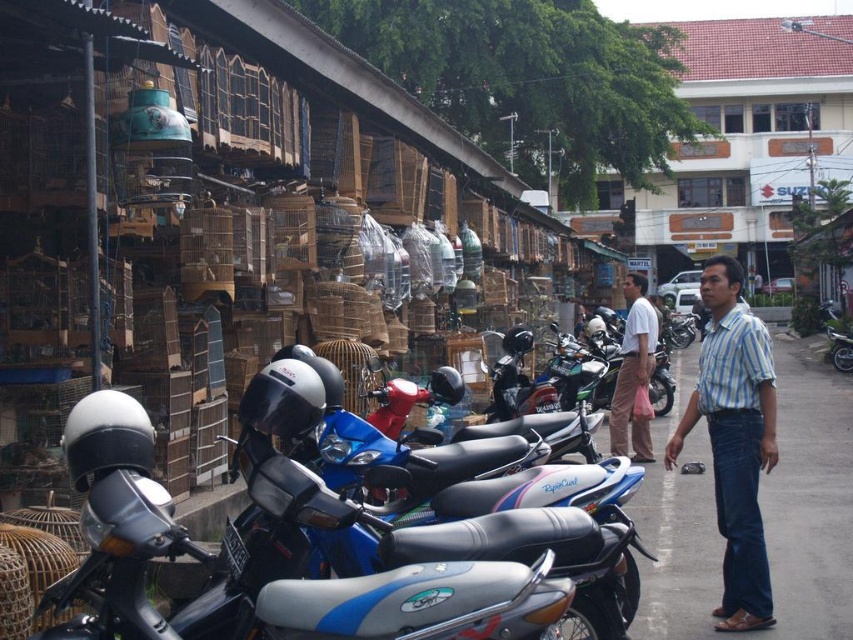
You are a pedestrian walking along the street and notice two shirts hanging on the motorbikes at the center of the scene. Which shirt is closer to the ground, the blue striped shirt at center or the white shirt at center?

The blue striped shirt at center is positioned under the white shirt at center, so it is closer to the ground.

You are a customer at the bird market and want to buy a shirt. You see a blue striped shirt at center and a white shirt at center. Which shirt is bigger in size?

The blue striped shirt at center is larger in size than the white shirt at center.